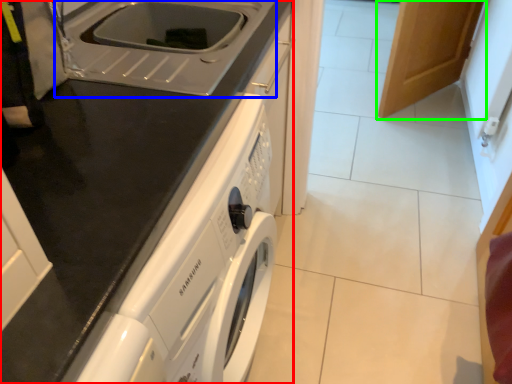
Question: Estimate the real-world distances between objects in this image. Which object is farther from home appliance (highlighted by a red box), sink (highlighted by a blue box) or cabinetry (highlighted by a green box)?

Choices:
 (A) sink
 (B) cabinetry

Answer: (B)